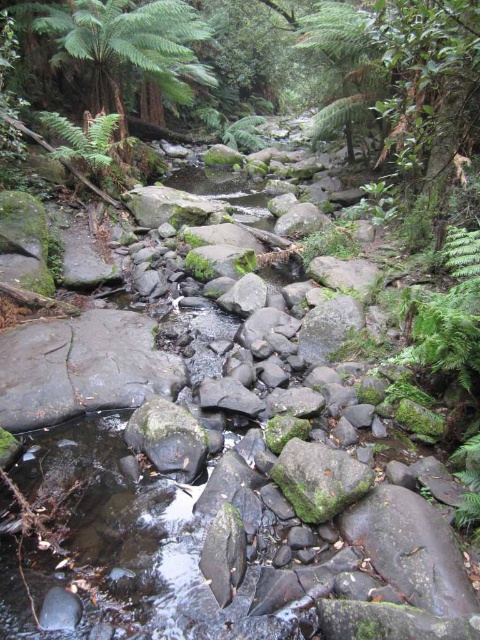
Who is higher up, green mossy rock at center or green fuzzy fern at upper left?

Positioned higher is green fuzzy fern at upper left.

Is green mossy rock at center thinner than green fuzzy fern at upper left?

Correct, green mossy rock at center's width is less than green fuzzy fern at upper left's.

What do you see at coordinates (319, 480) in the screenshot? The image size is (480, 640). I see `green mossy rock at center` at bounding box center [319, 480].

At what (x,y) coordinates should I click in order to perform the action: click on green mossy rock at center. Please return your answer as a coordinate pair (x, y). Looking at the image, I should click on (319, 480).